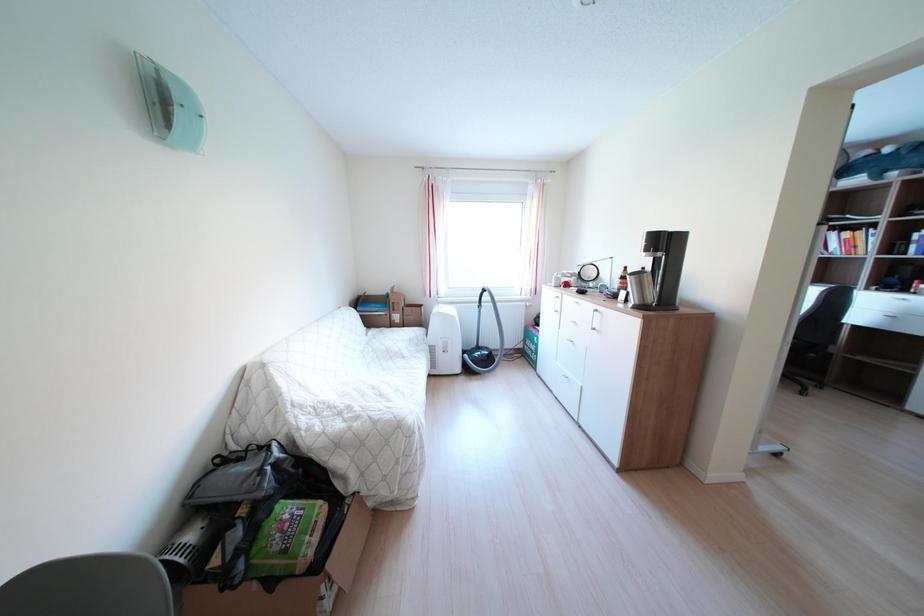
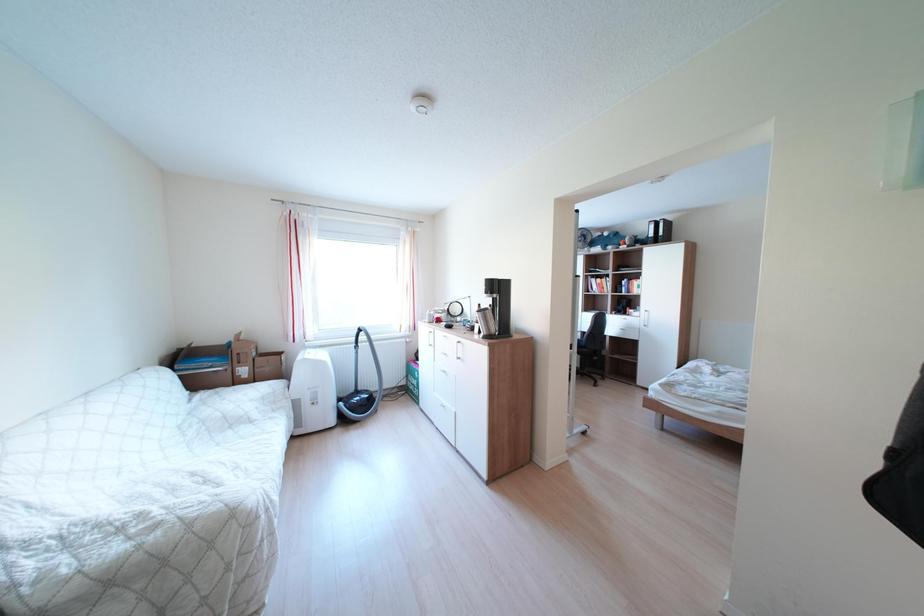
Question: Based on the continuous images, in which direction is the camera rotating? Reply with the corresponding letter.

Choices:
 (A) Left
 (B) Right
 (C) Up
 (D) Down

Answer: (B)